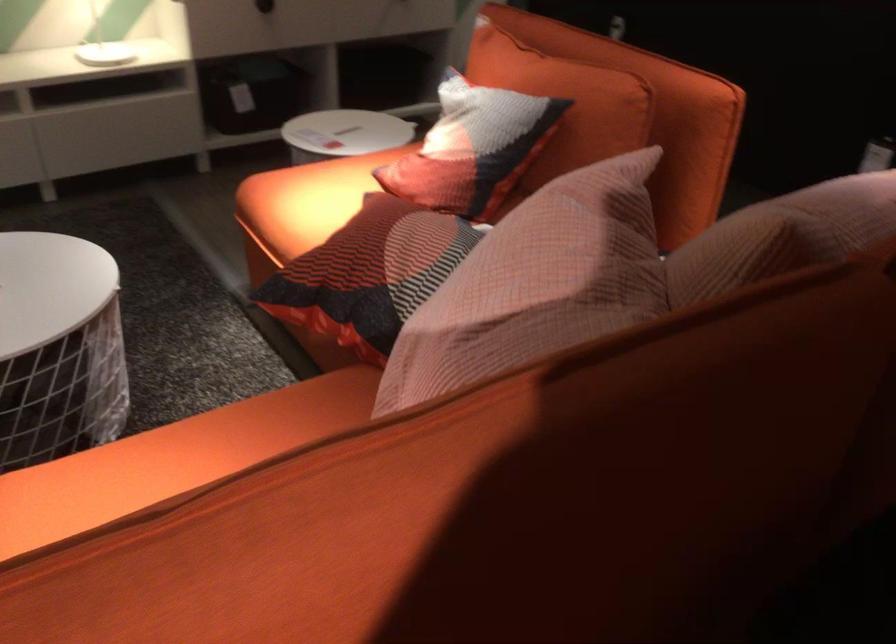
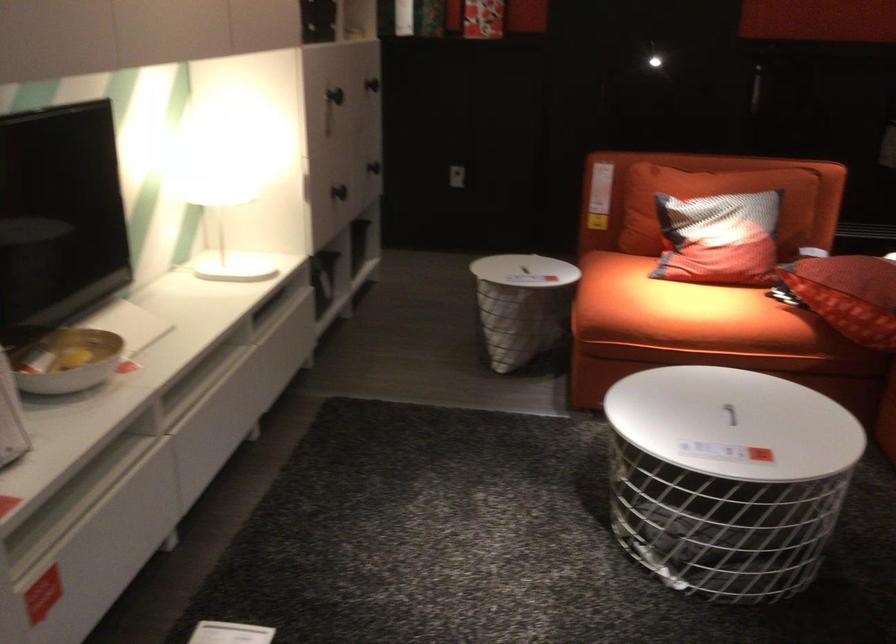
Question: I am providing you with two images of the same scene from different viewpoints. Which of the following objects are not visible in image2?

Choices:
 (A) sofa sitting surface
 (B) table lid handle
 (C) bed pillow
 (D) red patterned pillow

Answer: (A)